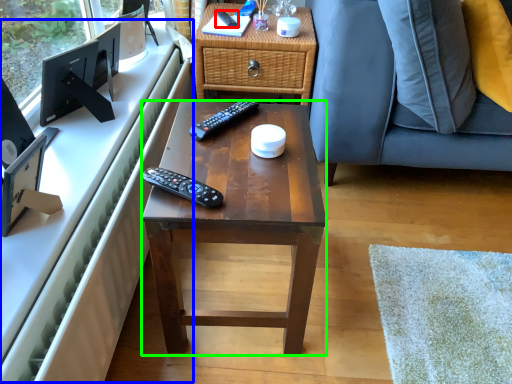
Question: Which is nearer to the remote control (highlighted by a red box)? computer desk (highlighted by a blue box) or desk (highlighted by a green box).

Choices:
 (A) computer desk
 (B) desk

Answer: (A)